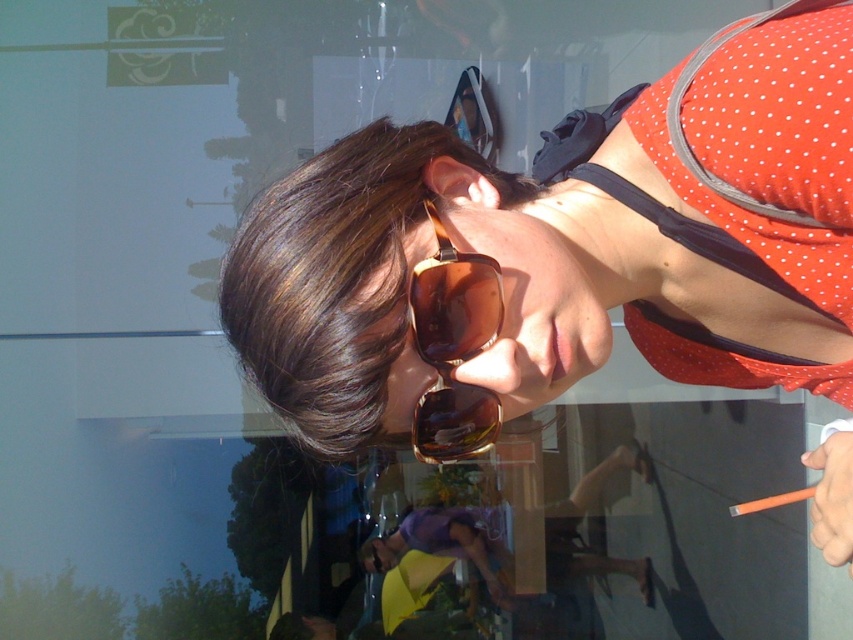
You are a photographer trying to capture both the matte gold sunglasses at upper center and the brown matte sunglasses at center in a single shot. Which pair of sunglasses will appear larger in the photo?

The matte gold sunglasses at upper center will appear larger in the photo because it is closer to the viewer than the brown matte sunglasses at center.

You are standing in front of a reflective glass surface. You see the reflection of a person wearing a red polka dot dress with black straps and large brown tinted sunglasses. There is also a point at coordinates (569, 244). What object is located at that point?

The point at (569, 244) indicates the matte gold sunglasses at upper center.

You are a fashion designer observing the image. You need to decide which object, the brown shiny hair at center or the brown matte sunglasses at center, has a greater width. Which one is wider?

The brown shiny hair at center is wider than the brown matte sunglasses at center because the description states that the brown shiny hair at center has a larger width.